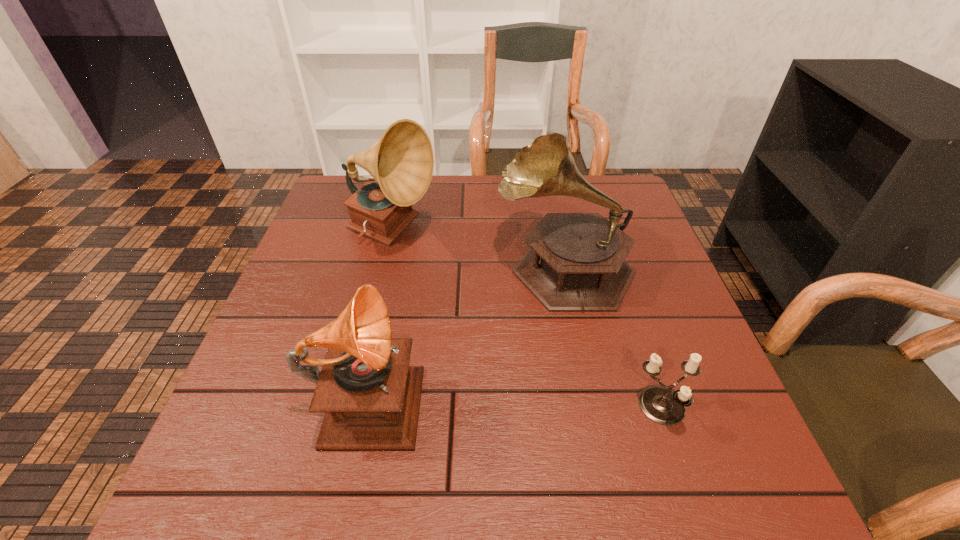
Image resolution: width=960 pixels, height=540 pixels. I want to click on the rightmost phonograph record, so click(x=576, y=261).

Identify the location of the nearest phonograph record. (371, 397).

Where is `the shortest object`? This screenshot has width=960, height=540. the shortest object is located at coordinates (659, 403).

The image size is (960, 540). What are the coordinates of `free space located 0.150m on the horn direction of the rightmost phonograph record` in the screenshot? It's located at coord(436,266).

Where is `vacant space positioned 0.160m on the horn direction of the rightmost phonograph record`? The image size is (960, 540). vacant space positioned 0.160m on the horn direction of the rightmost phonograph record is located at coordinates (432, 266).

Image resolution: width=960 pixels, height=540 pixels. Identify the location of vacant space located 0.100m on the horn direction of the rightmost phonograph record. (456, 266).

The width and height of the screenshot is (960, 540). In order to click on vacant space located on the horn of the nearest phonograph record in this screenshot , I will do `click(533, 392)`.

Locate an element on the screen. The height and width of the screenshot is (540, 960). free space located 0.230m on the left of the candle holder is located at coordinates (509, 408).

Locate an element on the screen. This screenshot has width=960, height=540. object situated at the far edge is located at coordinates (401, 162).

Identify the location of phonograph record located at the right edge. (576, 261).